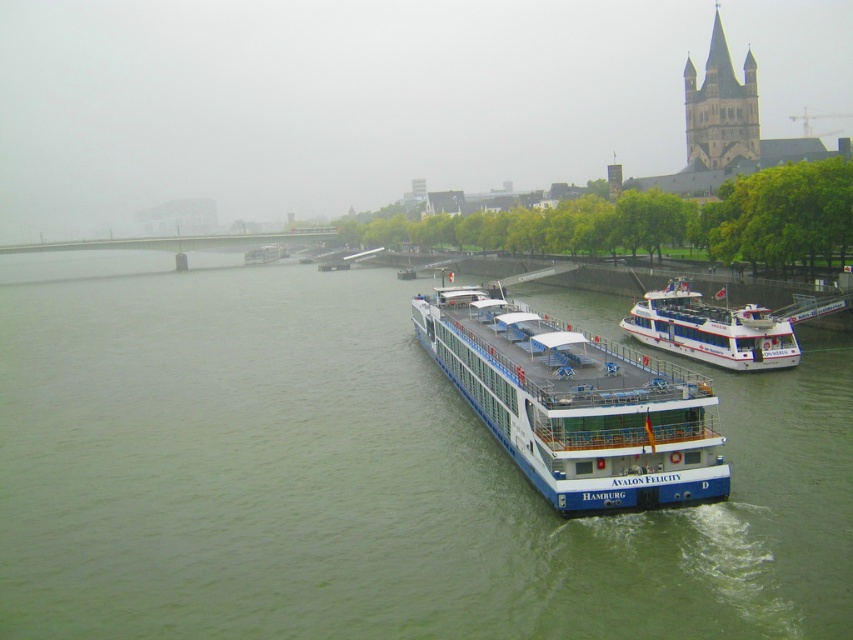
You are standing at the riverside and want to reach a specific point marked at coordinates point (584, 298). Given that the distance from your current position to this point is 98.69 meters, is this point within a reasonable walking distance for a person?

The point (584, 298) is 98.69 meters away from the camera, so yes, this point is within a reasonable walking distance for a person as it is less than 100 meters.

You are a photographer planning to capture the entire white glossy boat at center and the green water at center in a single frame. Given that your camera has a fixed field of view, which object should you position closer to the center of the frame to ensure both are fully visible?

Since the green water at center is wider than the white glossy boat at center, you should position the green water at center closer to the center of the frame to ensure both are fully visible.